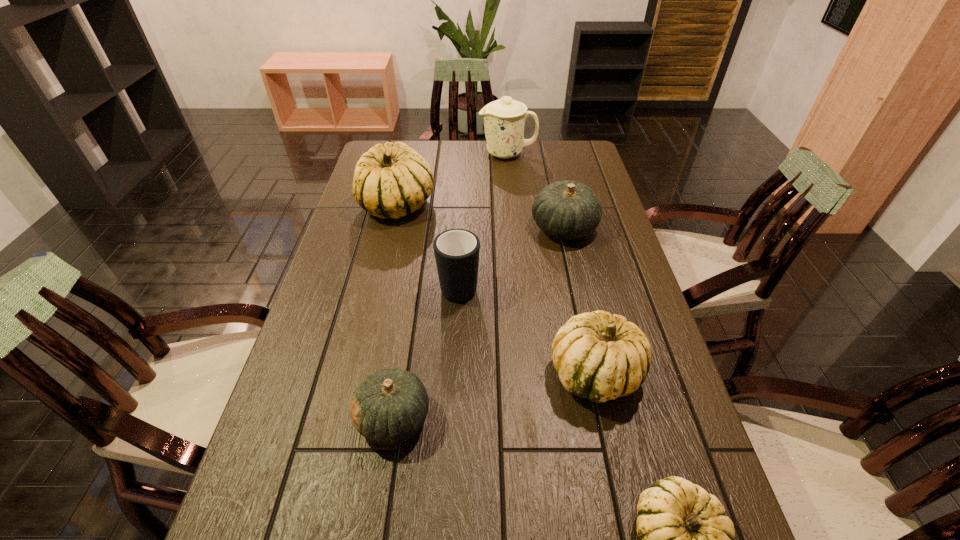
Find the location of `the farthest object`. the farthest object is located at coordinates (504, 119).

This screenshot has height=540, width=960. I want to click on the tallest gourd, so click(392, 180).

You are a GUI agent. You are given a task and a screenshot of the screen. Output one action in this format:
    pyautogui.click(x=<x>, y=<y>)
    Task: Click on the farthest white gourd
    
    Given the screenshot: What is the action you would take?
    pyautogui.click(x=392, y=180)

This screenshot has height=540, width=960. Find the location of `the fourth farthest object`. the fourth farthest object is located at coordinates (456, 251).

Locate an element on the screen. Image resolution: width=960 pixels, height=540 pixels. the bigger orange gourd is located at coordinates coord(568,210).

What are the coordinates of `the right orange gourd` in the screenshot? It's located at click(568, 210).

The image size is (960, 540). In order to click on the second biggest white gourd in this screenshot , I will do `click(599, 356)`.

Locate an element on the screen. The width and height of the screenshot is (960, 540). the smaller orange gourd is located at coordinates (388, 407).

Locate an element on the screen. the left orange gourd is located at coordinates (388, 407).

What are the coordinates of `blank area located 0.230m on the spout of the farthest object` in the screenshot? It's located at (421, 154).